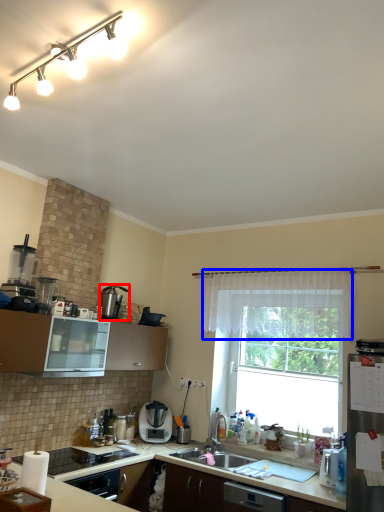
Question: Which object appears closest to the camera in this image, kitchen appliance (highlighted by a red box) or curtain (highlighted by a blue box)?

Choices:
 (A) kitchen appliance
 (B) curtain

Answer: (B)